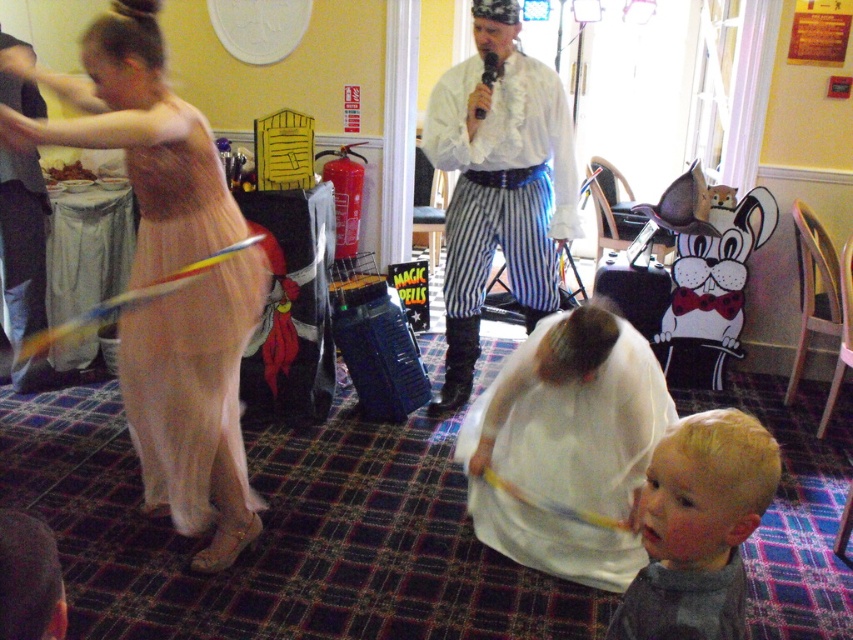
Question: Does translucent tulle dress at left have a smaller size compared to white ruffled shirt at center?

Choices:
 (A) no
 (B) yes

Answer: (B)

Question: Which point is farther to the camera?

Choices:
 (A) white sheer dress at center
 (B) matte pink dress at left
 (C) blonde hair boy at lower right

Answer: (A)

Question: Which point is farther from the camera taking this photo?

Choices:
 (A) (248, 324)
 (B) (519, 532)
 (C) (740, 636)
 (D) (141, 353)

Answer: (B)

Question: Is white ruffled shirt at center thinner than blonde hair boy at lower right?

Choices:
 (A) yes
 (B) no

Answer: (B)

Question: Among these points, which one is farthest from the camera?

Choices:
 (A) (468, 497)
 (B) (149, 444)
 (C) (738, 556)

Answer: (A)

Question: Does matte pink dress at left appear on the left side of translucent tulle dress at left?

Choices:
 (A) no
 (B) yes

Answer: (B)